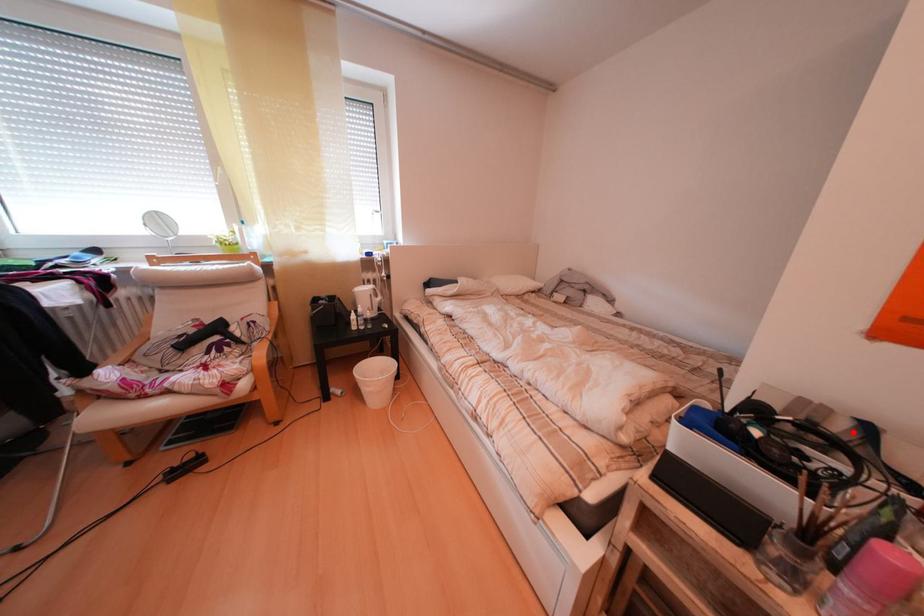
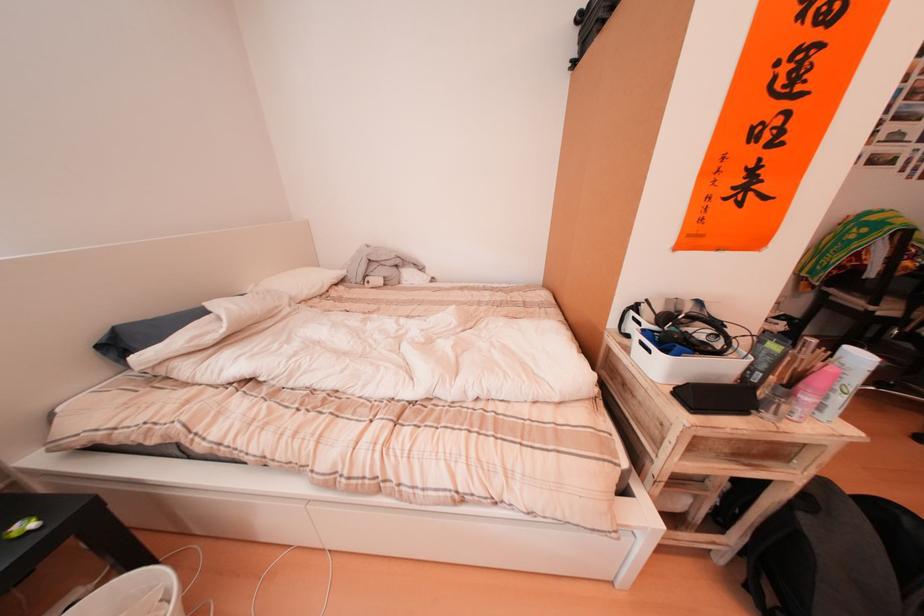
Locate, in the second image, the point that corresponds to the highlighted location in the first image.

(700, 313)